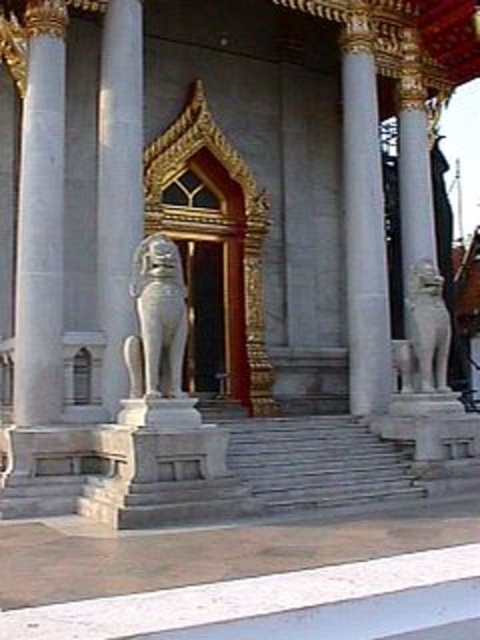
Question: Can you confirm if white marble pillar at right is thinner than white stone lion at right?

Choices:
 (A) yes
 (B) no

Answer: (A)

Question: Which point is closer to the camera?

Choices:
 (A) white marble pillar at right
 (B) white stone lion at right
 (C) white marble column at left
 (D) white marble lion at left

Answer: (D)

Question: Estimate the real-world distances between objects in this image. Which object is closer to the white marble column at center?

Choices:
 (A) white stone lion at right
 (B) white marble pillar at center
 (C) white marble pillar at right
 (D) white marble column at left

Answer: (A)

Question: Observing the image, what is the correct spatial positioning of white marble column at left in reference to white marble column at center?

Choices:
 (A) left
 (B) right

Answer: (A)

Question: Does white marble pillar at center appear over white marble column at center?

Choices:
 (A) yes
 (B) no

Answer: (B)

Question: Considering the real-world distances, which object is farthest from the white stone lion at right?

Choices:
 (A) white marble pillar at right
 (B) white marble lion at left

Answer: (B)